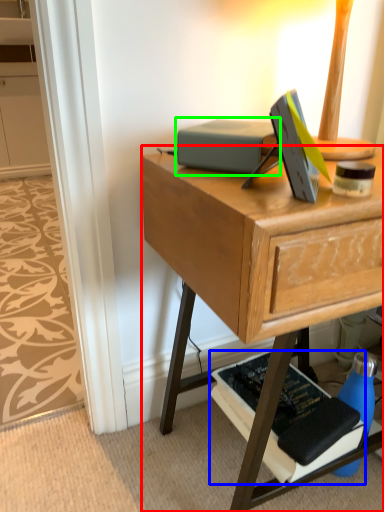
Question: Which is nearer to the desk (highlighted by a red box)? paperback book (highlighted by a blue box) or paperback book (highlighted by a green box).

Choices:
 (A) paperback book
 (B) paperback book

Answer: (B)